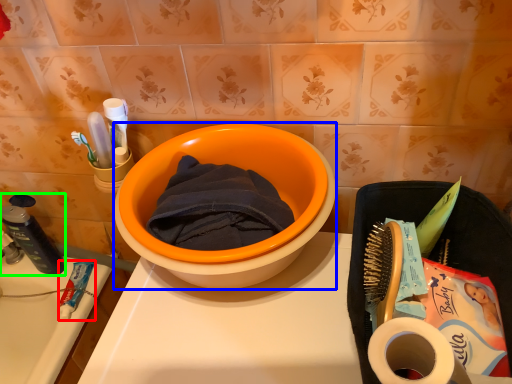
Question: Which object is positioned farthest from stationery (highlighted by a red box)? Select from basin (highlighted by a blue box) and stationery (highlighted by a green box).

Choices:
 (A) basin
 (B) stationery

Answer: (A)